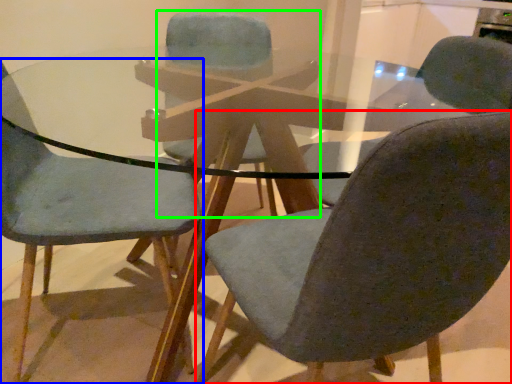
Question: Estimate the real-world distances between objects in this image. Which object is farther from chair (highlighted by a red box), chair (highlighted by a blue box) or chair (highlighted by a green box)?

Choices:
 (A) chair
 (B) chair

Answer: (B)